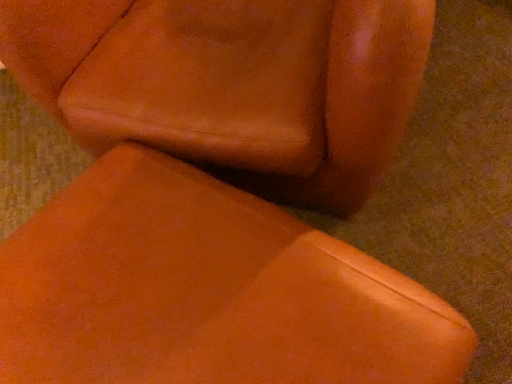
Question: From the image's perspective, is matte leather chair at center, positioned as the second chair in top-to-bottom order, below leather chair at center, the 2th chair ordered from the bottom?

Choices:
 (A) no
 (B) yes

Answer: (B)

Question: From a real-world perspective, is matte leather chair at center, the 1th chair in the bottom-to-top sequence, beneath leather chair at center, arranged as the 1th chair when viewed from the top?

Choices:
 (A) no
 (B) yes

Answer: (B)

Question: From the image's perspective, is matte leather chair at center, positioned as the second chair in top-to-bottom order, on top of leather chair at center, the 2th chair ordered from the bottom?

Choices:
 (A) yes
 (B) no

Answer: (B)

Question: Is matte leather chair at center, positioned as the second chair in top-to-bottom order, wider than leather chair at center, arranged as the 1th chair when viewed from the top?

Choices:
 (A) no
 (B) yes

Answer: (A)

Question: Can you confirm if matte leather chair at center, the 1th chair in the bottom-to-top sequence, is thinner than leather chair at center, the 2th chair ordered from the bottom?

Choices:
 (A) yes
 (B) no

Answer: (A)

Question: Could you tell me if matte leather chair at center, the 1th chair in the bottom-to-top sequence, is turned towards leather chair at center, arranged as the 1th chair when viewed from the top?

Choices:
 (A) no
 (B) yes

Answer: (A)

Question: Is leather chair at center, arranged as the 1th chair when viewed from the top, smaller than matte leather chair at center, the 1th chair in the bottom-to-top sequence?

Choices:
 (A) yes
 (B) no

Answer: (B)

Question: From a real-world perspective, is leather chair at center, arranged as the 1th chair when viewed from the top, on matte leather chair at center, the 1th chair in the bottom-to-top sequence?

Choices:
 (A) no
 (B) yes

Answer: (B)

Question: Does leather chair at center, arranged as the 1th chair when viewed from the top, come behind matte leather chair at center, the 1th chair in the bottom-to-top sequence?

Choices:
 (A) yes
 (B) no

Answer: (A)

Question: Can you confirm if leather chair at center, the 2th chair ordered from the bottom, is bigger than matte leather chair at center, the 1th chair in the bottom-to-top sequence?

Choices:
 (A) no
 (B) yes

Answer: (B)

Question: Is leather chair at center, arranged as the 1th chair when viewed from the top, wider than matte leather chair at center, positioned as the second chair in top-to-bottom order?

Choices:
 (A) no
 (B) yes

Answer: (B)

Question: Is leather chair at center, arranged as the 1th chair when viewed from the top, directly adjacent to matte leather chair at center, the 1th chair in the bottom-to-top sequence?

Choices:
 (A) no
 (B) yes

Answer: (A)

Question: In terms of size, does leather chair at center, the 2th chair ordered from the bottom, appear bigger or smaller than matte leather chair at center, positioned as the second chair in top-to-bottom order?

Choices:
 (A) small
 (B) big

Answer: (B)